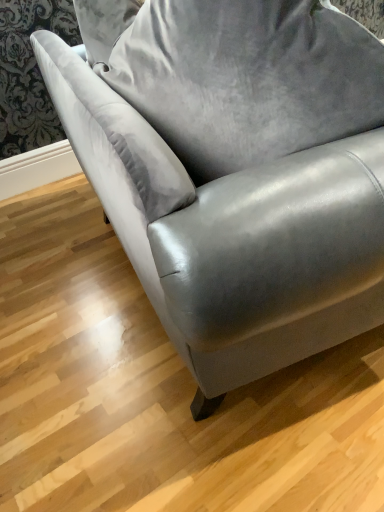
This screenshot has height=512, width=384. What do you see at coordinates (247, 78) in the screenshot?
I see `velvet gray pillow at center` at bounding box center [247, 78].

Identify the location of velvet gray pillow at center. The width and height of the screenshot is (384, 512). (247, 78).

Where is `velvet gray pillow at center`? The height and width of the screenshot is (512, 384). velvet gray pillow at center is located at coordinates (247, 78).